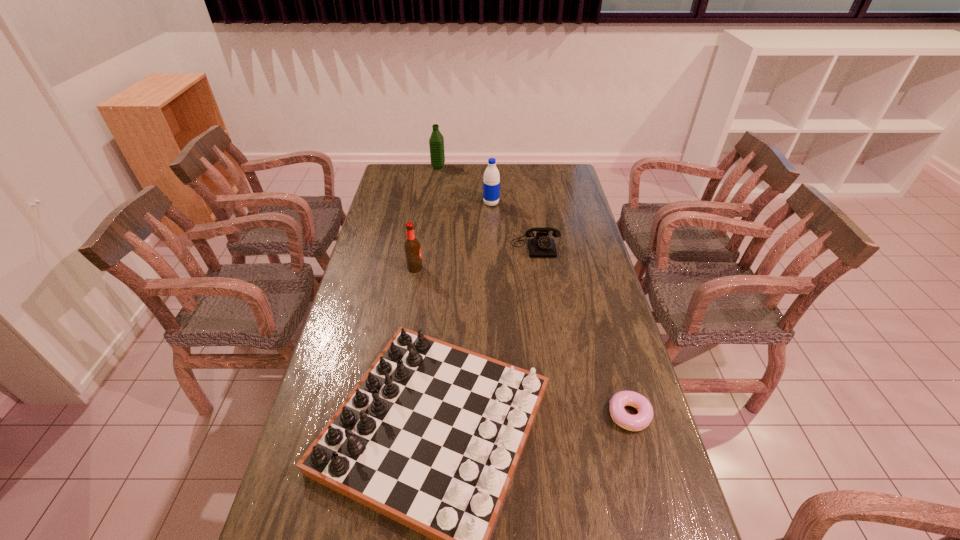
Where is `object that stands as the closest to the right water bottle`? The height and width of the screenshot is (540, 960). object that stands as the closest to the right water bottle is located at coordinates (541, 246).

Find the location of a particular element. Image resolution: width=960 pixels, height=540 pixels. vacant area in the image that satisfies the following two spatial constraints: 1. on the back side of the right water bottle; 2. on the left side of the fourth farthest object is located at coordinates (426, 204).